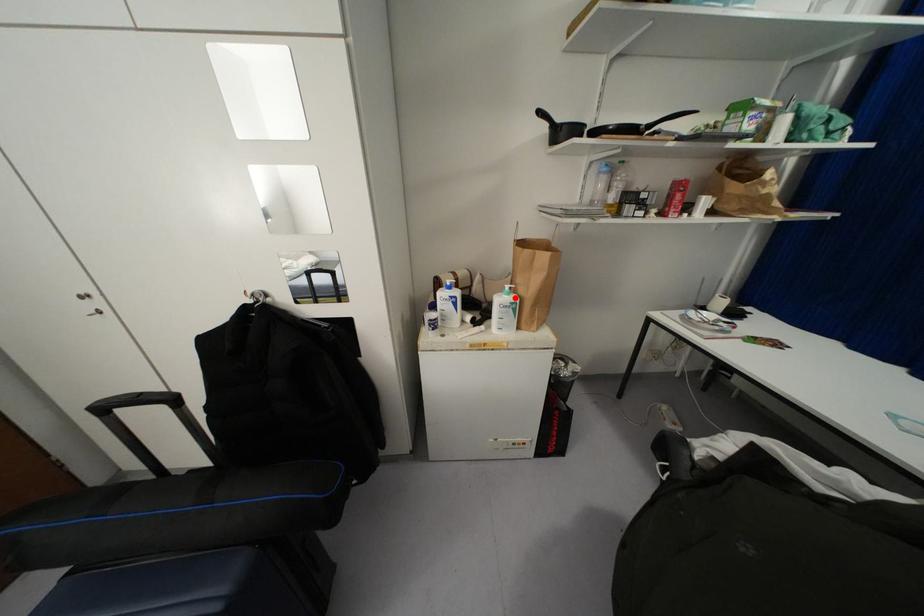
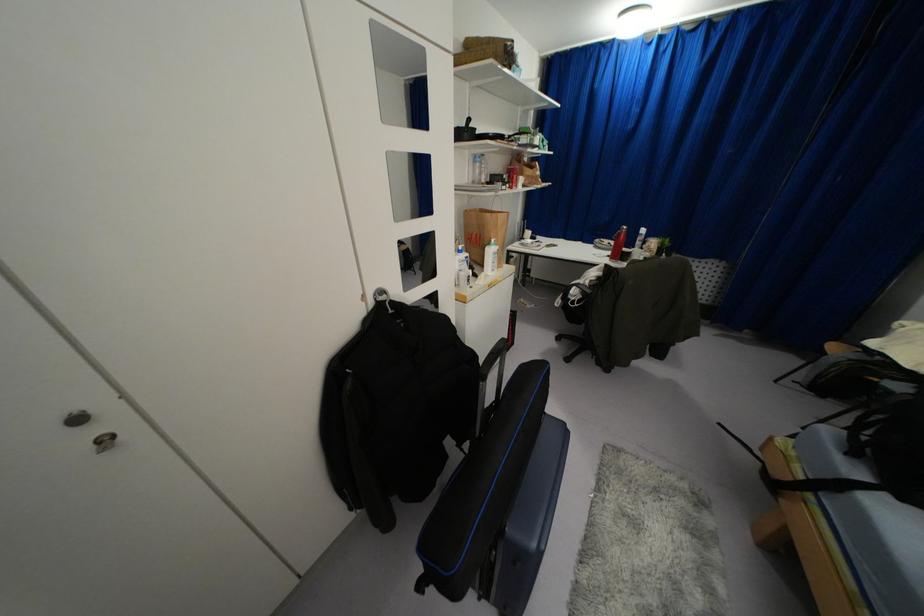
Where in the second image is the point corresponding to the highlighted location from the first image?

(495, 246)